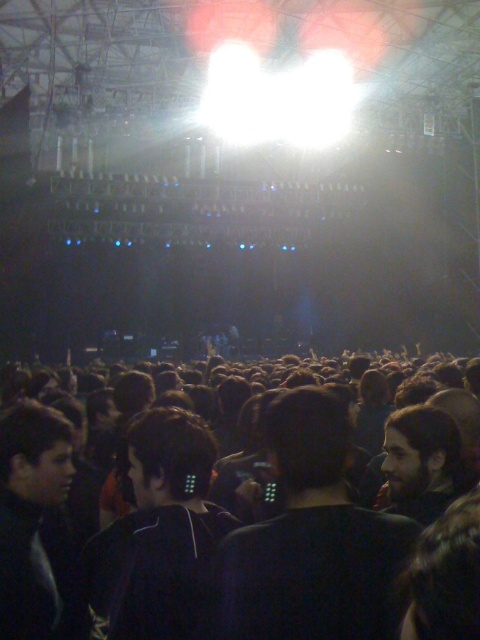
You are standing at the center of the concert venue and want to move towards the stage. There is a point marked at coordinates point (271, 525) which marks the black fabric crowd at center. Can you walk straight towards the stage without passing through the crowd?

The point (271, 525) marks the black fabric crowd at center, so walking straight towards the stage would require passing through the crowd.

You are a photographer trying to capture a closeup of the black matte earbuds at center without the black fabric crowd at center blocking the view. Is the crowd wider than the earbuds?

The black fabric crowd at center is wider than the black matte earbuds at center, so the crowd will block the view of the earbuds.

You are a photographer standing at the back of the venue, and you want to capture a photo of both the black fabric crowd at center and the black matte hair at center in the same frame. Given that your camera has a maximum focus range of 17 feet, will you be able to focus on both subjects simultaneously?

The black fabric crowd at center and black matte hair at center are 16.99 feet apart from each other, which is within the camera maximum focus range of 17 feet. Therefore, you can focus on both subjects simultaneously.